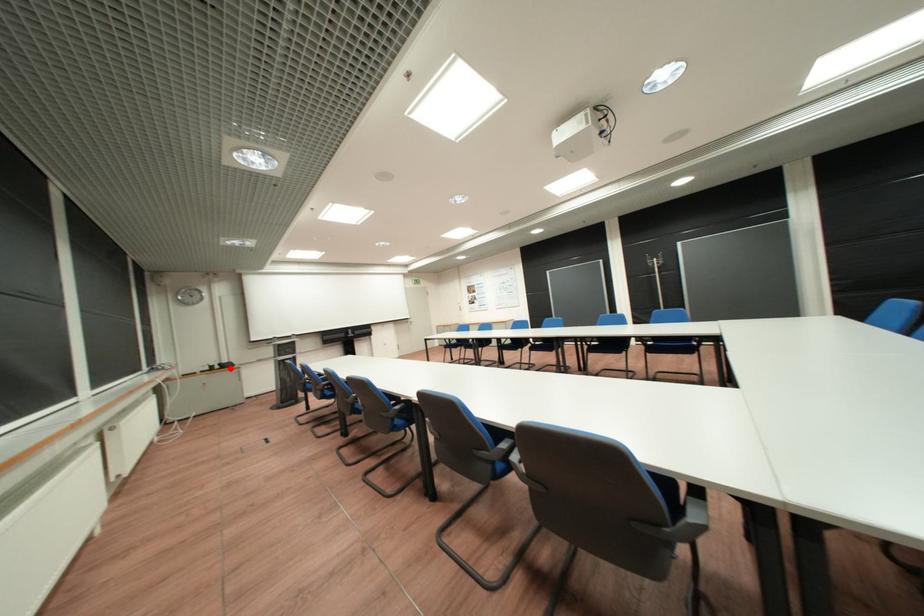
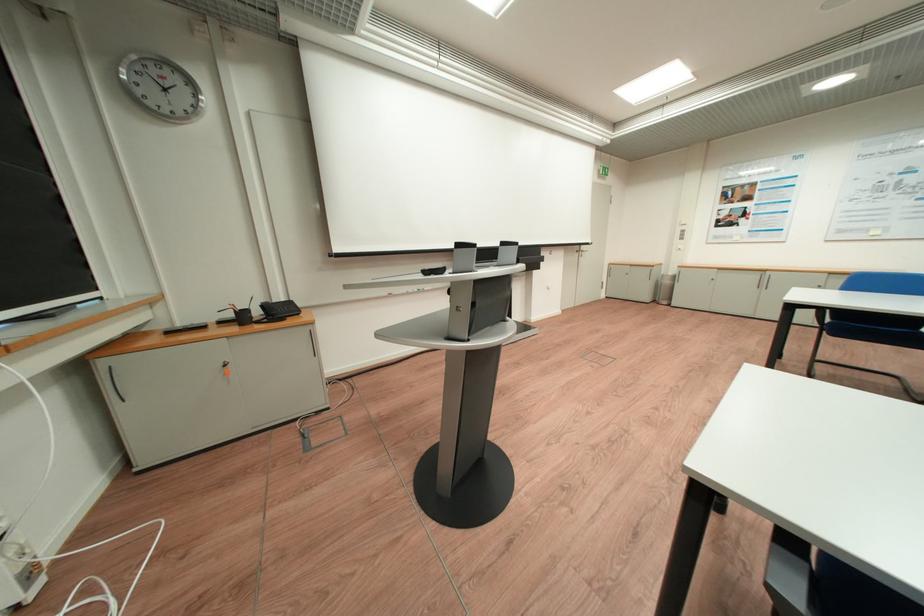
Question: I am providing you with two images of the same scene from different viewpoints. In image1, a red point is highlighted. Considering the same 3D point in image2, which of the following is correct?

Choices:
 (A) It is closer
 (B) It is farther

Answer: (A)